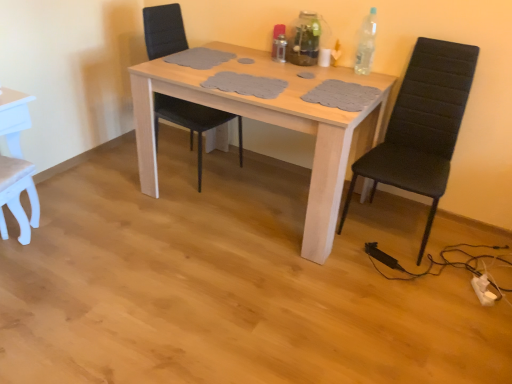
Locate an element on the screen. This screenshot has height=384, width=512. vacant space underneath white matte chair at lower left, which ranks as the first chair in left-to-right order (from a real-world perspective) is located at coordinates (19, 256).